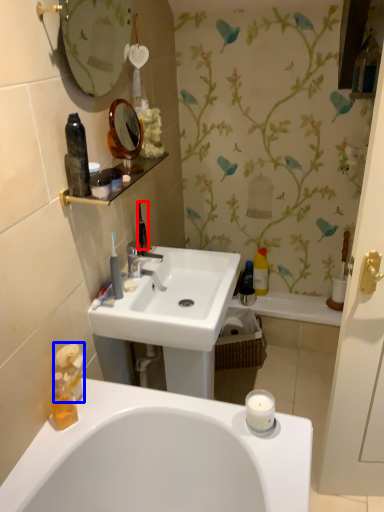
Question: Among these objects, which one is farthest to the camera, toiletries (highlighted by a red box) or toiletry (highlighted by a blue box)?

Choices:
 (A) toiletries
 (B) toiletry

Answer: (A)